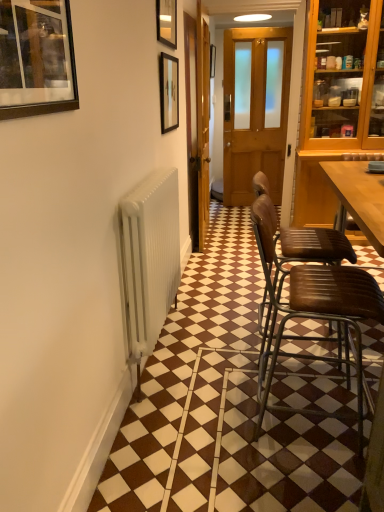
Image resolution: width=384 pixels, height=512 pixels. I want to click on vacant region to the left of brown leather chair at right, marked as the 1th chair in a front-to-back arrangement, so click(x=212, y=428).